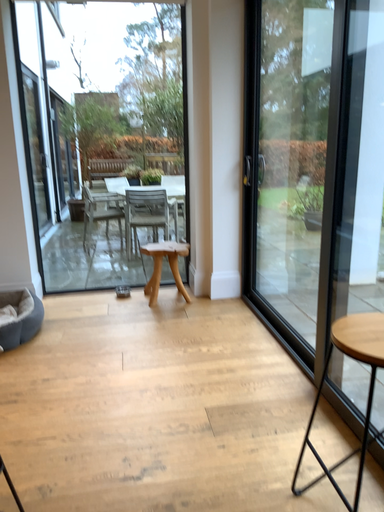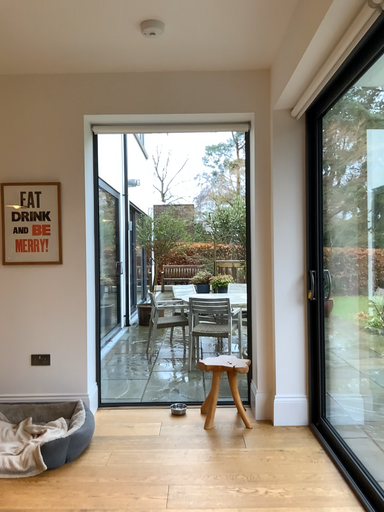
Question: How did the camera likely rotate when shooting the video?

Choices:
 (A) rotated left
 (B) rotated right

Answer: (A)